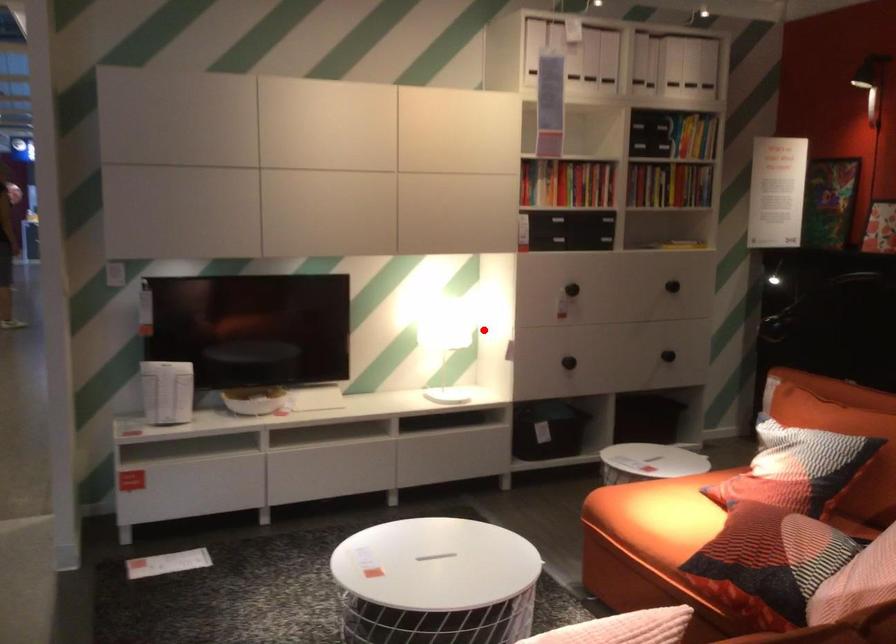
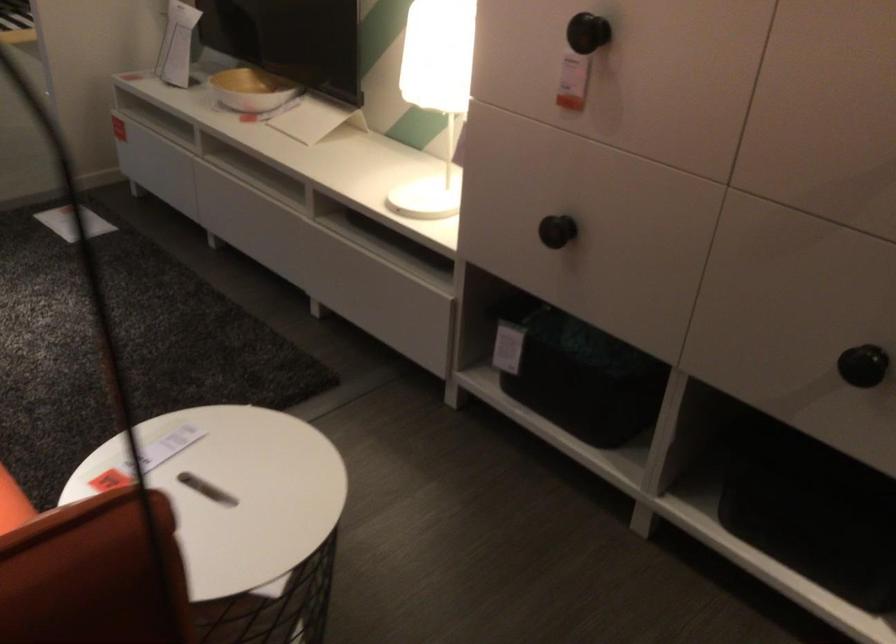
The point at the highlighted location is marked in the first image. Where is the corresponding point in the second image?

(435, 93)